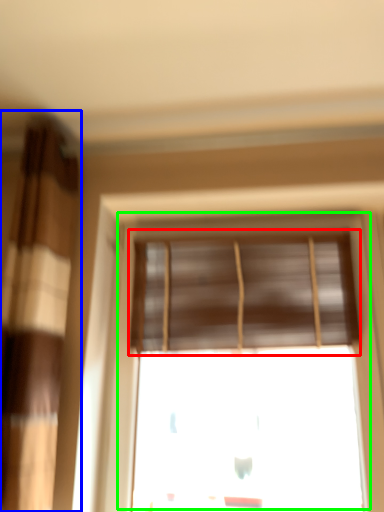
Question: Estimate the real-world distances between objects in this image. Which object is closer to window blind (highlighted by a red box), curtain (highlighted by a blue box) or window (highlighted by a green box)?

Choices:
 (A) curtain
 (B) window

Answer: (B)